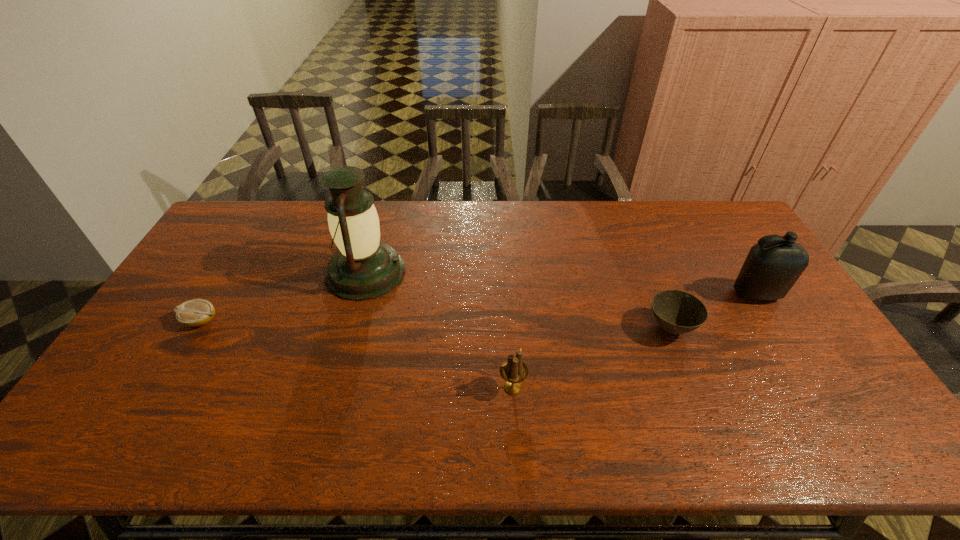
What are the coordinates of `free location located 0.150m with the light compartment facing forward on the lantern` in the screenshot? It's located at (452, 272).

This screenshot has width=960, height=540. What are the coordinates of `vacant space located 0.290m on the back of the fourth shortest object` in the screenshot? It's located at (714, 226).

Where is `free point located on the left of the third tallest object`? The width and height of the screenshot is (960, 540). free point located on the left of the third tallest object is located at coordinates (396, 388).

Where is `vacant space located 0.190m on the left of the second shortest object`? The image size is (960, 540). vacant space located 0.190m on the left of the second shortest object is located at coordinates (578, 328).

This screenshot has width=960, height=540. Find the location of `vacant space located on the right of the leftmost object`. vacant space located on the right of the leftmost object is located at coordinates (325, 321).

At what (x,y) coordinates should I click in order to perform the action: click on object at the left edge. Please return your answer as a coordinate pair (x, y). Looking at the image, I should click on (196, 312).

Find the location of a particular element. object that is at the right edge is located at coordinates (771, 268).

The width and height of the screenshot is (960, 540). In the image, there is a desktop. Identify the location of vacant space at the far edge. (681, 224).

You are a GUI agent. You are given a task and a screenshot of the screen. Output one action in this format:
    pyautogui.click(x=<x>, y=<y>)
    Task: Click on the free location at the near edge of the desktop
    Image resolution: width=960 pixels, height=540 pixels.
    Given the screenshot: What is the action you would take?
    pyautogui.click(x=592, y=419)

In the image, there is a desktop. What are the coordinates of `vacant space at the left edge` in the screenshot? It's located at (239, 243).